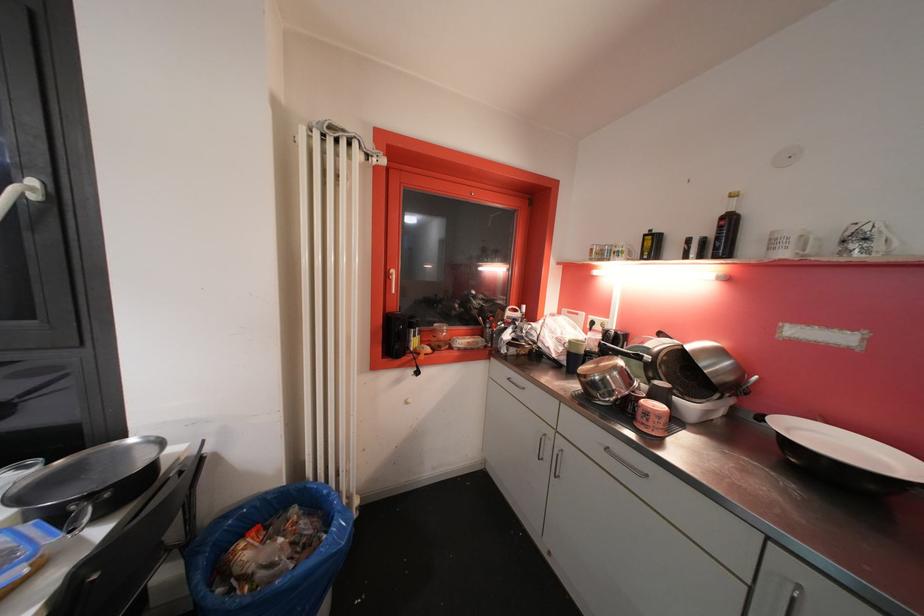
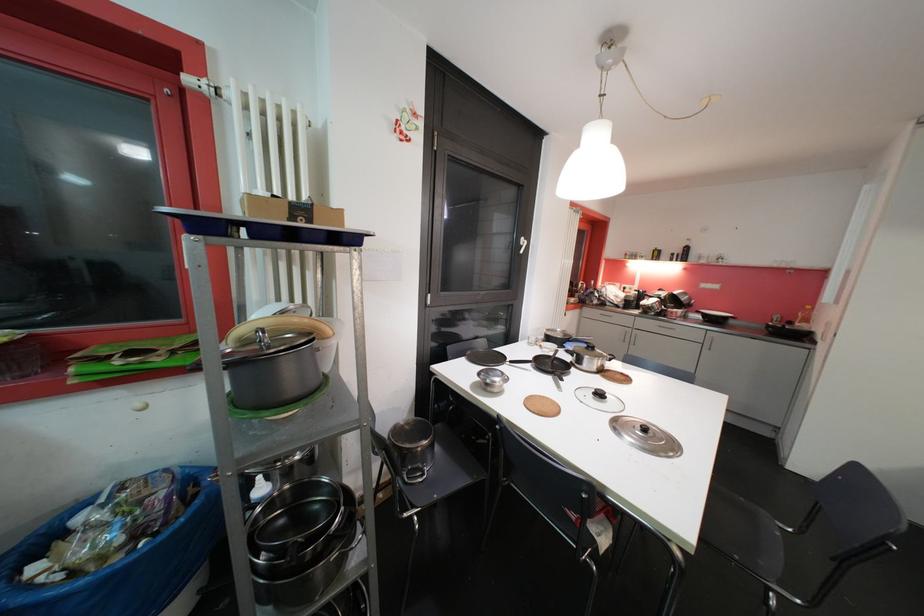
The images are taken continuously from a first-person perspective. In which direction are you moving?

The movement direction of the cameraman is left, backward.